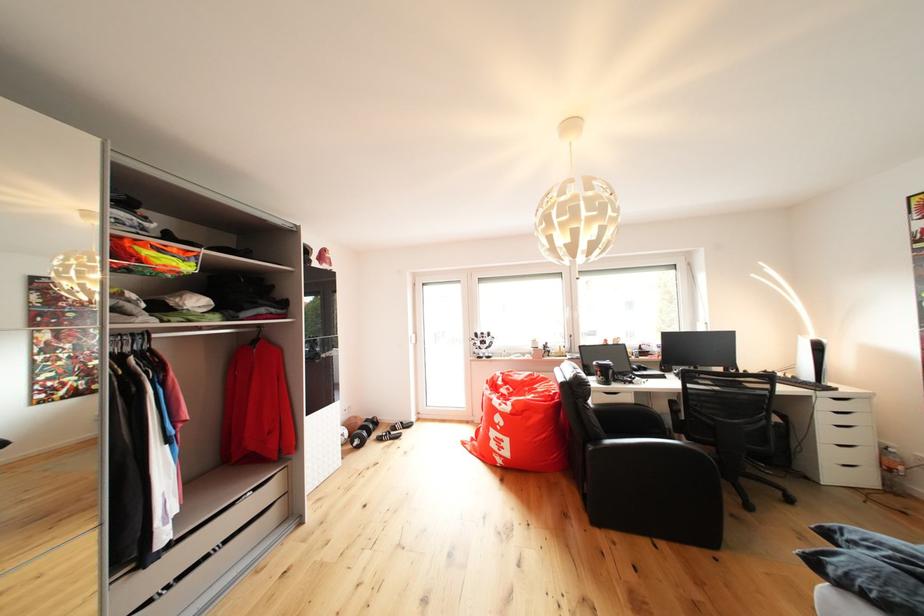
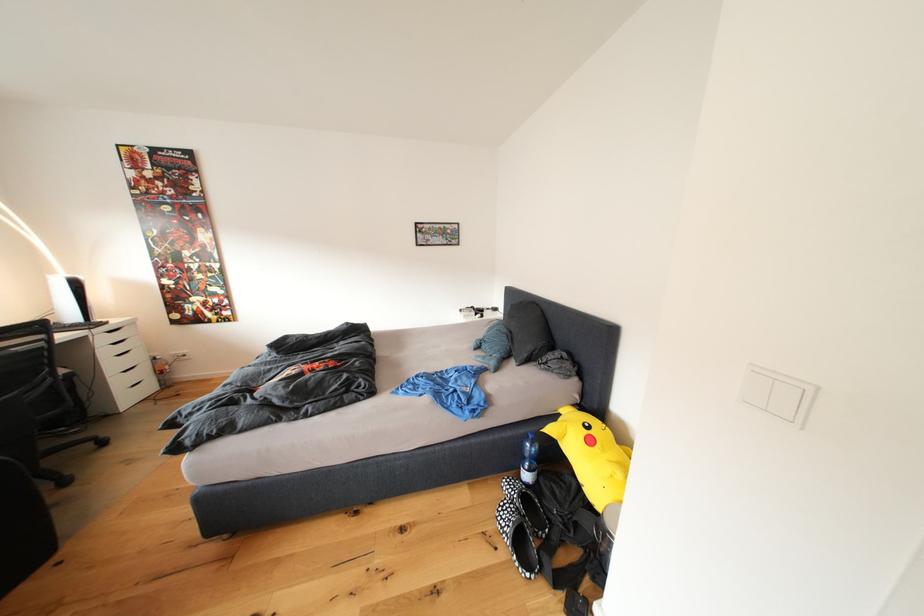
Find the pixel in the second image that matches pixel 833 408 in the first image.

(111, 344)